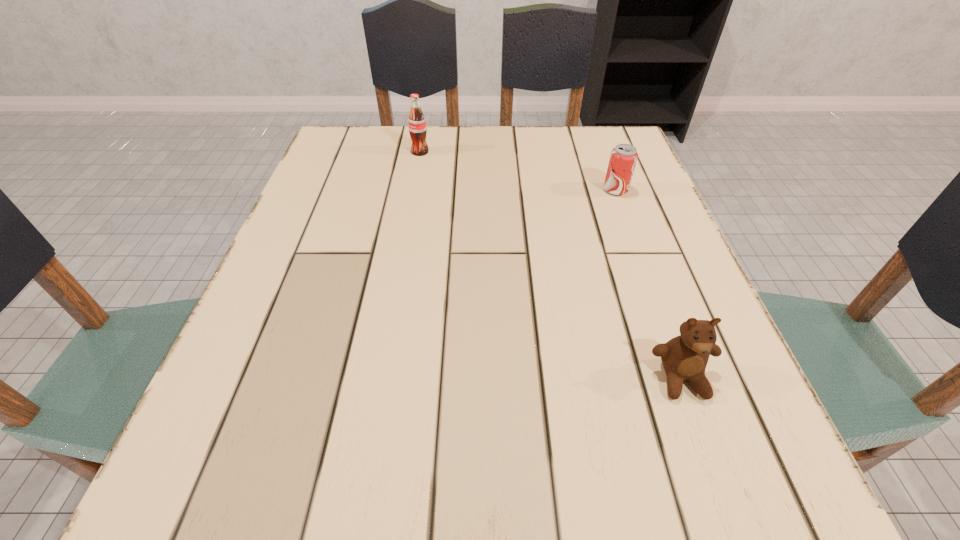
You are a GUI agent. You are given a task and a screenshot of the screen. Output one action in this format:
    pyautogui.click(x=<x>, y=<y>)
    Task: Click on the soda can that is at the right edge
    The width and height of the screenshot is (960, 540).
    Given the screenshot: What is the action you would take?
    (623, 158)

I want to click on vacant space at the far edge of the desktop, so pos(501,176).

Find the location of `free space at the near edge of the desktop`. free space at the near edge of the desktop is located at coordinates (531, 457).

Identify the location of free space at the left edge. click(x=241, y=394).

The image size is (960, 540). I want to click on vacant space at the right edge of the desktop, so click(x=685, y=399).

This screenshot has height=540, width=960. In order to click on free space at the far left corner of the desktop in this screenshot , I will do `click(343, 140)`.

Where is `unoccupied position between the shorter soda can and the taller soda can`? unoccupied position between the shorter soda can and the taller soda can is located at coordinates (517, 171).

You are a GUI agent. You are given a task and a screenshot of the screen. Output one action in this format:
    pyautogui.click(x=<x>, y=<y>)
    Task: Click on the unoccupied position between the farther soda can and the teddy bear
    
    Given the screenshot: What is the action you would take?
    pyautogui.click(x=551, y=265)

At what (x,y) coordinates should I click in order to perform the action: click on free space between the teddy bear and the farthest object. Please return your answer as a coordinate pair (x, y). Looking at the image, I should click on (551, 265).

The image size is (960, 540). Identify the location of free space between the right soda can and the nearest object. (648, 284).